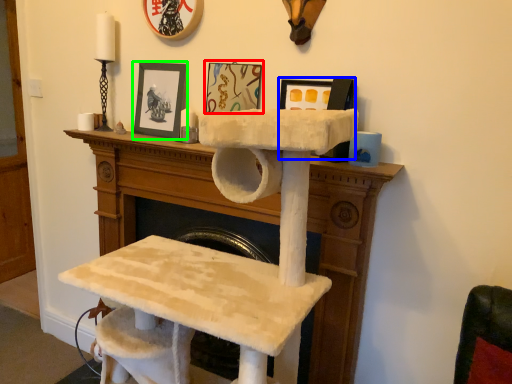
Question: Which object is the closest to the picture frame (highlighted by a red box)? Choose among these: picture frame (highlighted by a blue box) or picture frame (highlighted by a green box).

Choices:
 (A) picture frame
 (B) picture frame

Answer: (B)